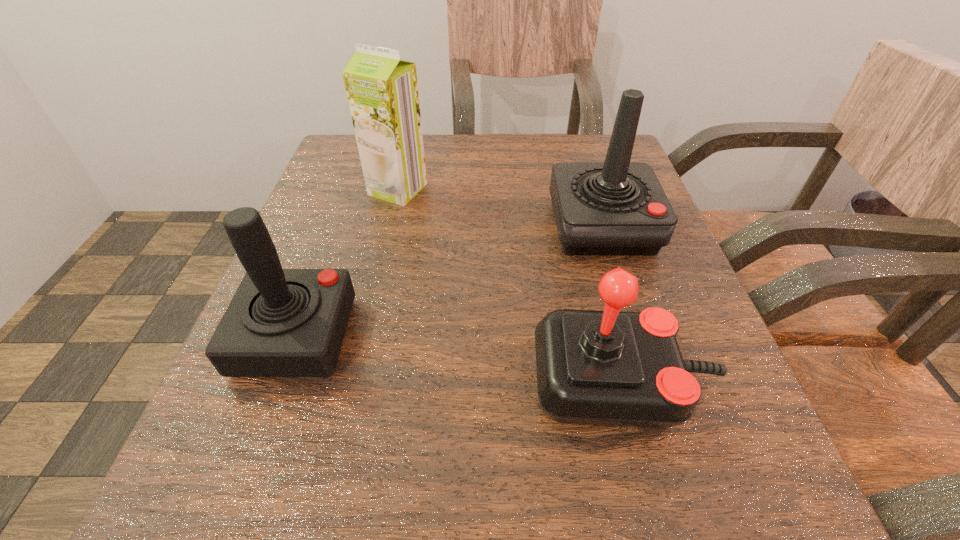
Where is `soya milk`? soya milk is located at coordinates (382, 90).

In order to click on the farthest joystick in this screenshot , I will do click(617, 207).

In order to click on the leftmost joystick in this screenshot , I will do `click(280, 322)`.

Locate an element on the screen. The image size is (960, 540). vacant space located 0.080m on the left of the soya milk is located at coordinates (330, 190).

At what (x,y) coordinates should I click in order to perform the action: click on vacant space located on the front-facing side of the farthest joystick. Please return your answer as a coordinate pair (x, y). Looking at the image, I should click on (660, 414).

The height and width of the screenshot is (540, 960). I want to click on free space located 0.170m on the base of the leftmost joystick, so click(468, 336).

This screenshot has width=960, height=540. Find the location of `object at the far edge`. object at the far edge is located at coordinates (382, 90).

The height and width of the screenshot is (540, 960). I want to click on soya milk located at the left edge, so click(382, 90).

I want to click on joystick that is positioned at the left edge, so click(x=280, y=322).

Locate an element on the screen. The image size is (960, 540). object present at the far left corner is located at coordinates (382, 90).